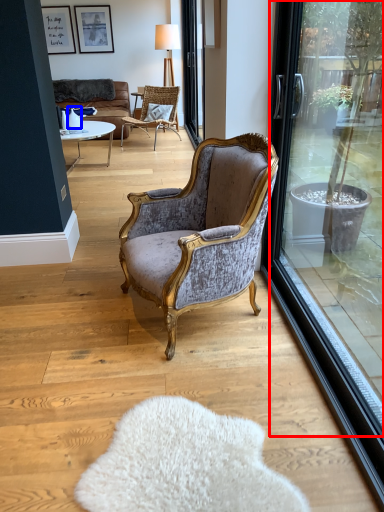
Question: Which object appears farthest to the camera in this image, window screen (highlighted by a red box) or vase (highlighted by a blue box)?

Choices:
 (A) window screen
 (B) vase

Answer: (B)